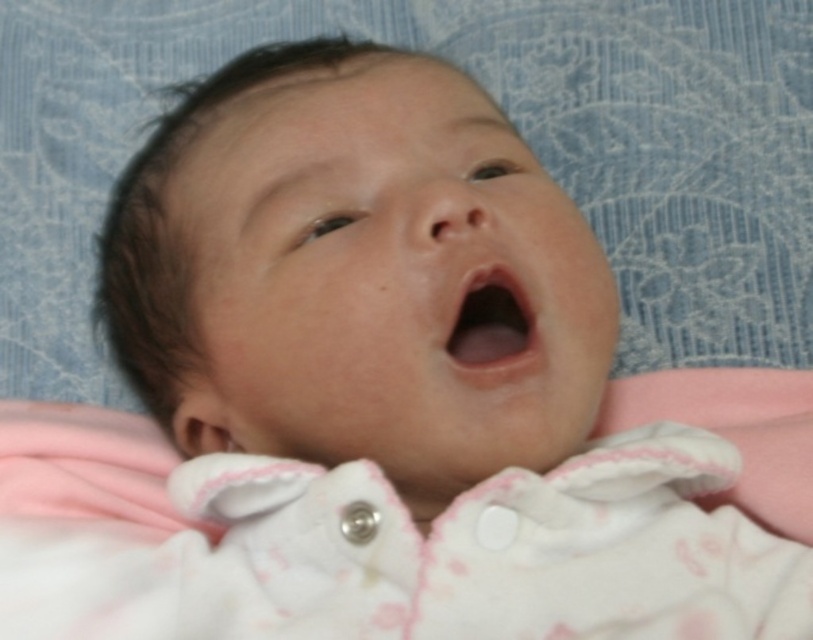
Which of these two, pink fabric at center or pink smooth skin at center, stands shorter?

With less height is pink smooth skin at center.

Find the location of a particular element. pink fabric at center is located at coordinates (377, 544).

The height and width of the screenshot is (640, 813). What do you see at coordinates (377, 544) in the screenshot? I see `pink fabric at center` at bounding box center [377, 544].

The height and width of the screenshot is (640, 813). I want to click on pink fabric at center, so click(377, 544).